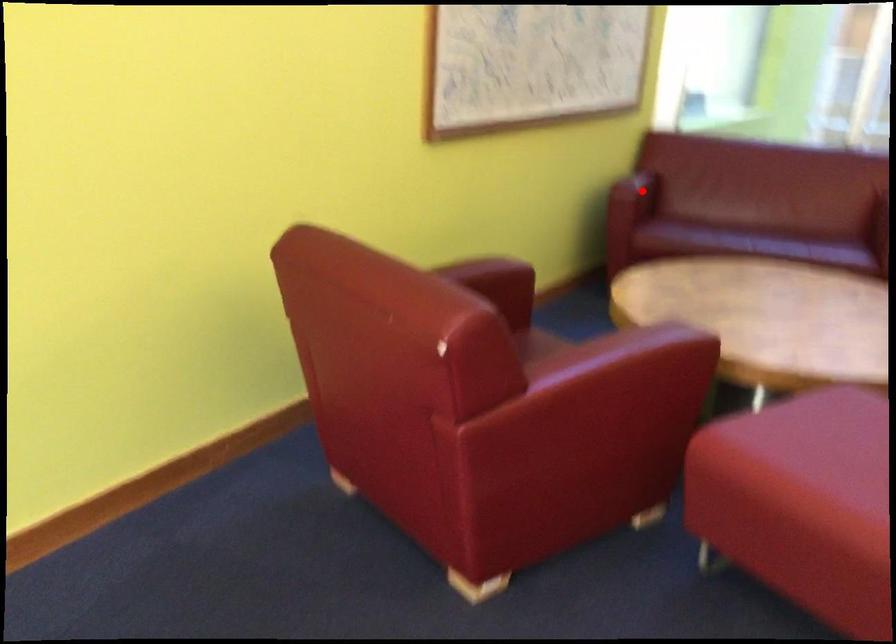
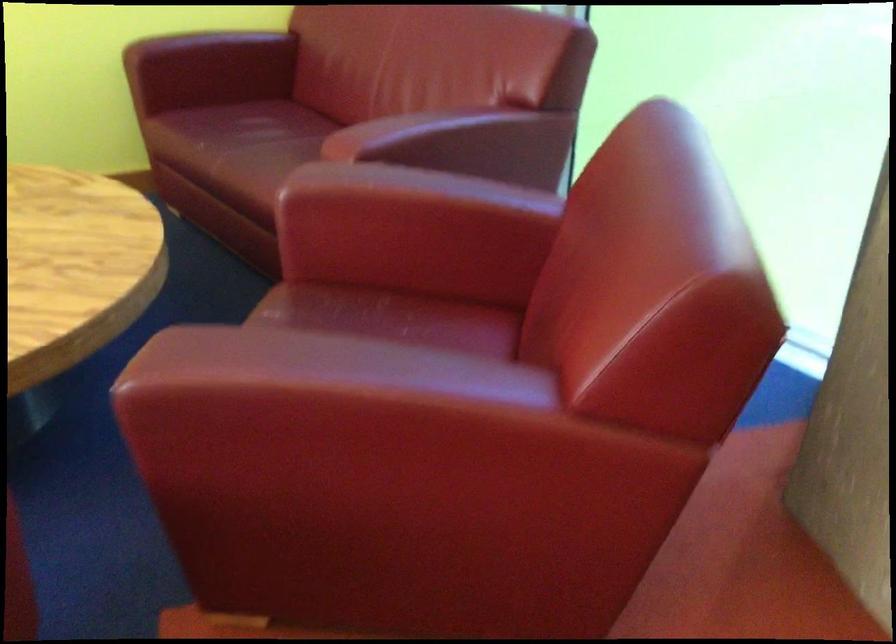
The point at the highlighted location is marked in the first image. Where is the corresponding point in the second image?

(208, 69)